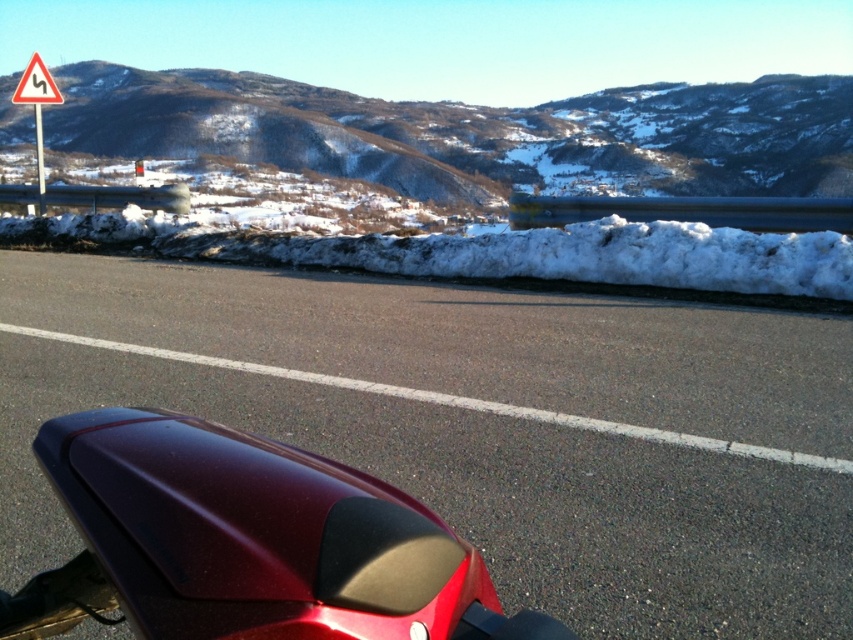
Question: Observing the image, what is the correct spatial positioning of glossy red motorcycle at lower center in reference to white plastic triangle at upper left?

Choices:
 (A) above
 (B) below

Answer: (B)

Question: Is snowy rocky mountain at upper center closer to camera compared to white triangular sign at upper left?

Choices:
 (A) no
 (B) yes

Answer: (A)

Question: Estimate the real-world distances between objects in this image. Which object is closer to the white plastic triangle at upper left?

Choices:
 (A) glossy red motorcycle at lower center
 (B) glossy maroon motorcycle at center
 (C) snowy rocky mountain at upper center

Answer: (A)

Question: Among these objects, which one is nearest to the camera?

Choices:
 (A) glossy red motorcycle at lower center
 (B) white triangular sign at upper left
 (C) white plastic triangle at upper left
 (D) glossy maroon motorcycle at center

Answer: (D)

Question: Where is snowy rocky mountain at upper center located in relation to white plastic triangle at upper left in the image?

Choices:
 (A) right
 (B) left

Answer: (A)

Question: Which point is farther from the camera taking this photo?

Choices:
 (A) click(x=844, y=426)
 (B) click(x=27, y=77)
 (C) click(x=158, y=525)
 (D) click(x=38, y=76)

Answer: (D)